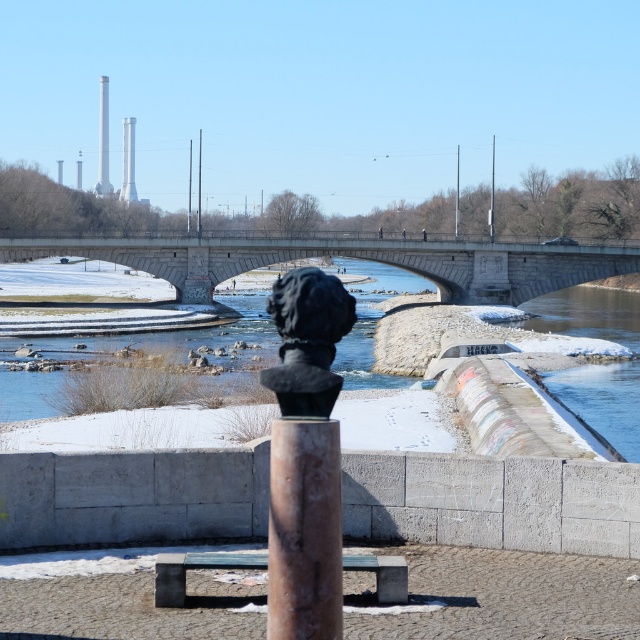
You are standing at the riverside and want to reach a specific point marked at coordinates point (378, 561). The path you need to take is 39.07 feet long. Is this path long enough to reach the point?

The distance of point (378, 561) from viewer is 39.07 feet, so the path of 39.07 feet is exactly the right length to reach the point.

You are standing at the point with coordinates (305, 531) in the riverside scene. What object are you standing on?

The point at (305, 531) corresponds to the rusty metal pole at center.

From the picture: You are a photographer wanting to capture both the stone bridge at center and the black polished stone bust at center in the same frame. Can you see both objects clearly without any obstruction?

The stone bridge at center is positioned over the black polished stone bust at center, so the bridge will block the view of the bust. You cannot see both clearly in the same frame.